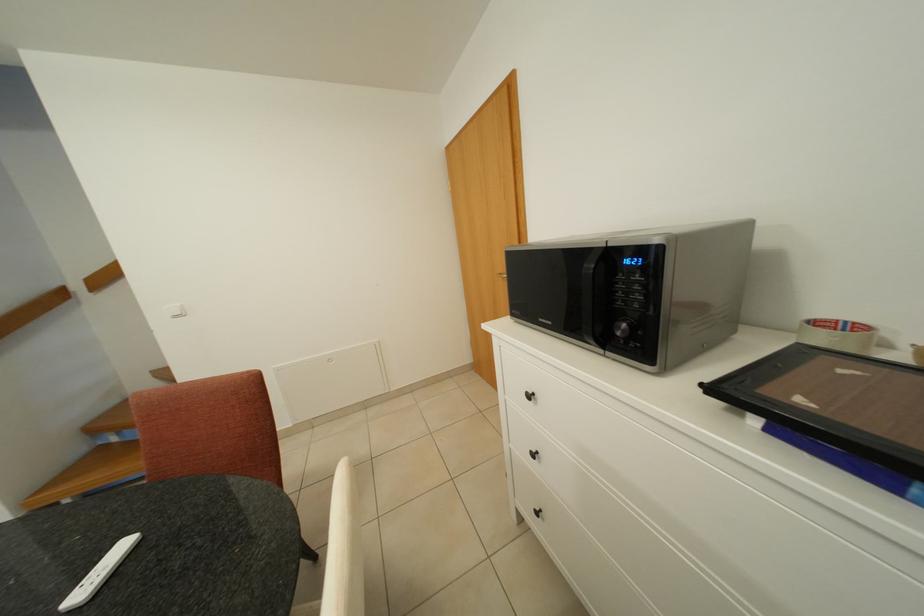
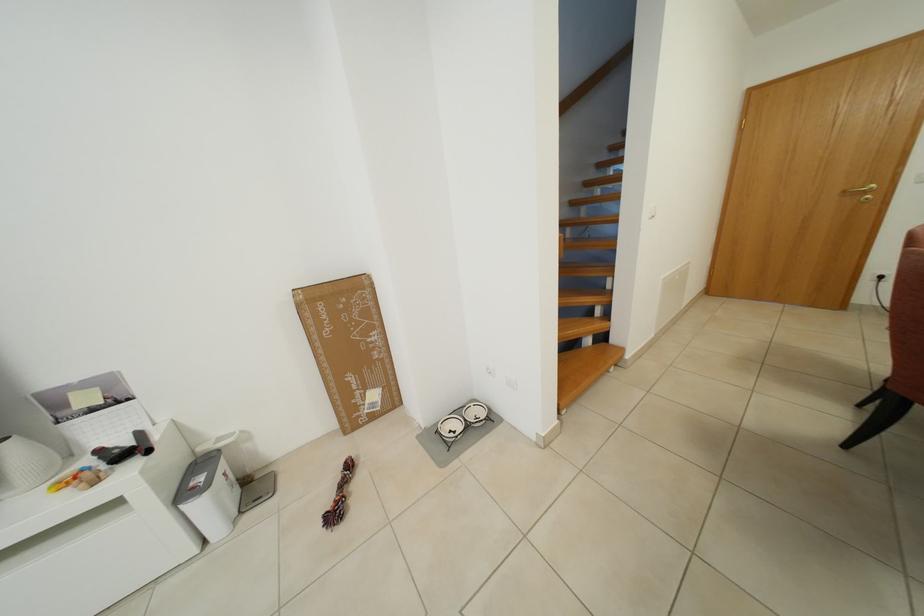
Question: Which direction would the cameraman need to move to produce the second image? Reply with the corresponding letter.

Choices:
 (A) Left
 (B) Right
 (C) Forward
 (D) Backward

Answer: (A)